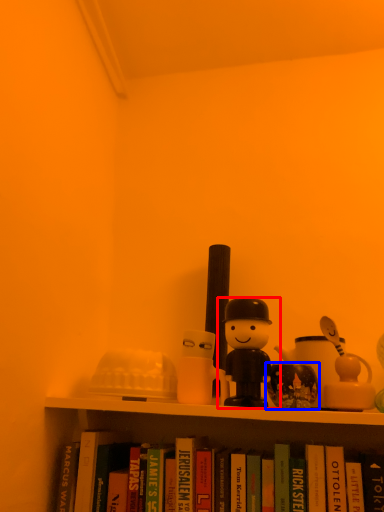
Question: Which point is further to the camera, toy (highlighted by a red box) or toy (highlighted by a blue box)?

Choices:
 (A) toy
 (B) toy

Answer: (B)